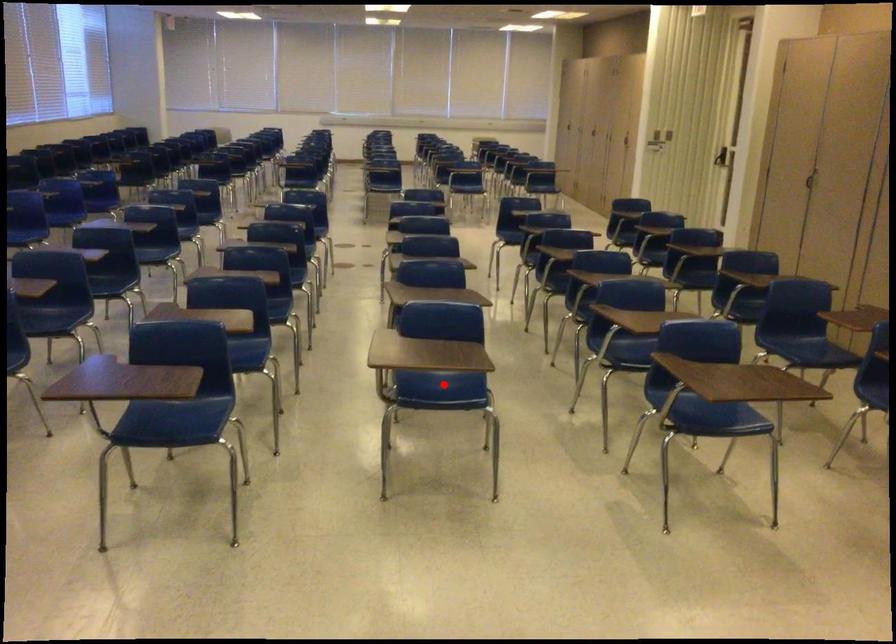
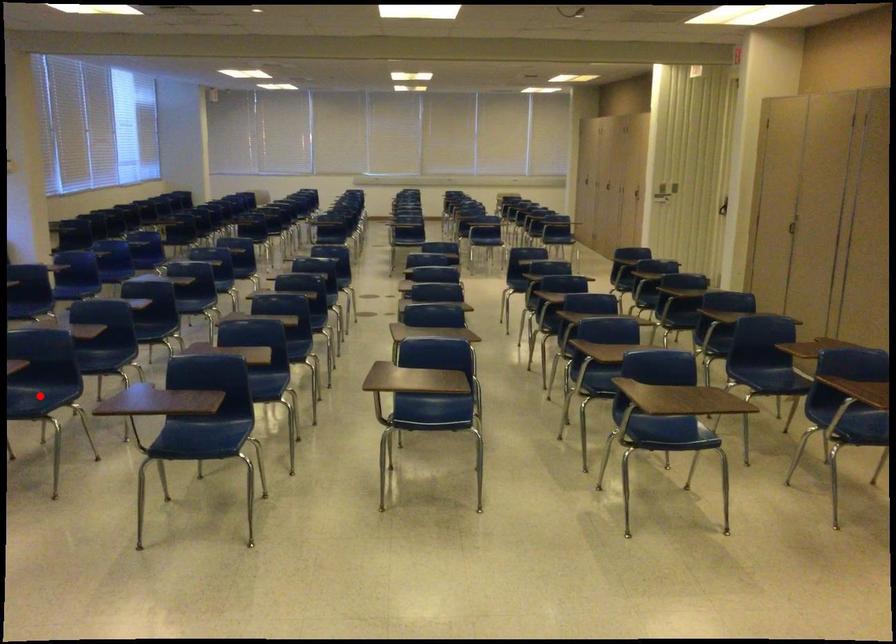
I am providing you with two images of the same scene from different viewpoints. A red point is marked on the first image and another point is marked on the second image. Is the red point in image1 aligned with the point shown in image2?

No